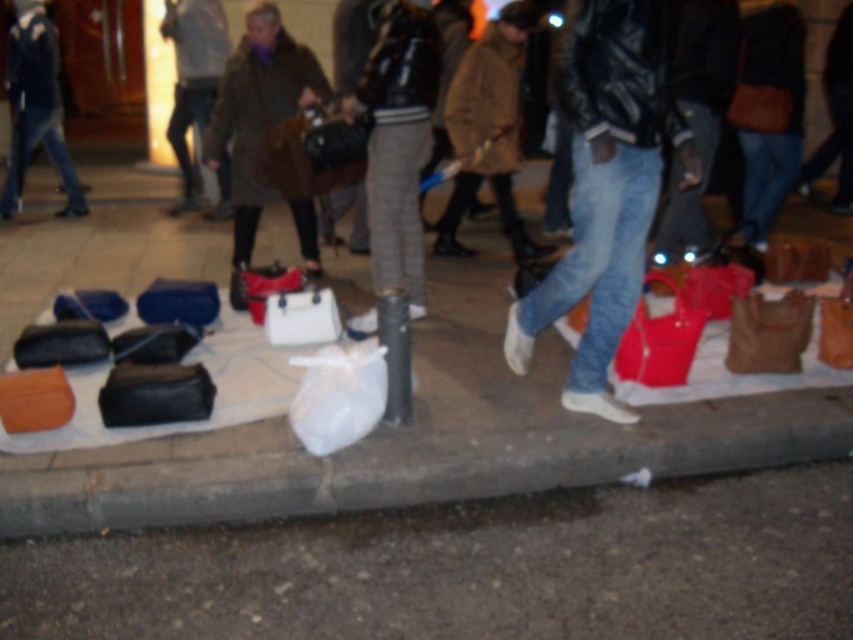
Is point (555, 531) positioned after point (554, 432)?

That is False.

Can you confirm if white plastic bag at lower center is positioned to the right of concrete curb at lower center?

Incorrect, white plastic bag at lower center is not on the right side of concrete curb at lower center.

Is point (222, 273) positioned behind point (91, 496)?

That is True.

Identify the location of white plastic bag at lower center. The width and height of the screenshot is (853, 640). (469, 566).

Does dull concrete pavement at lower center have a lesser height compared to black matte pole at center?

Indeed, dull concrete pavement at lower center has a lesser height compared to black matte pole at center.

Between point (73, 550) and point (405, 369), which one is positioned behind?

Positioned behind is point (405, 369).

Identify the location of dull concrete pavement at lower center. (469, 568).

Between point (456, 102) and point (381, 346), which one is positioned in front?

Positioned in front is point (381, 346).

Is leather coat at center smaller than white plastic bag at center?

Incorrect, leather coat at center is not smaller in size than white plastic bag at center.

This screenshot has height=640, width=853. What are the coordinates of `leather coat at center` in the screenshot? It's located at (488, 129).

Locate an element on the screen. leather coat at center is located at coordinates (488, 129).